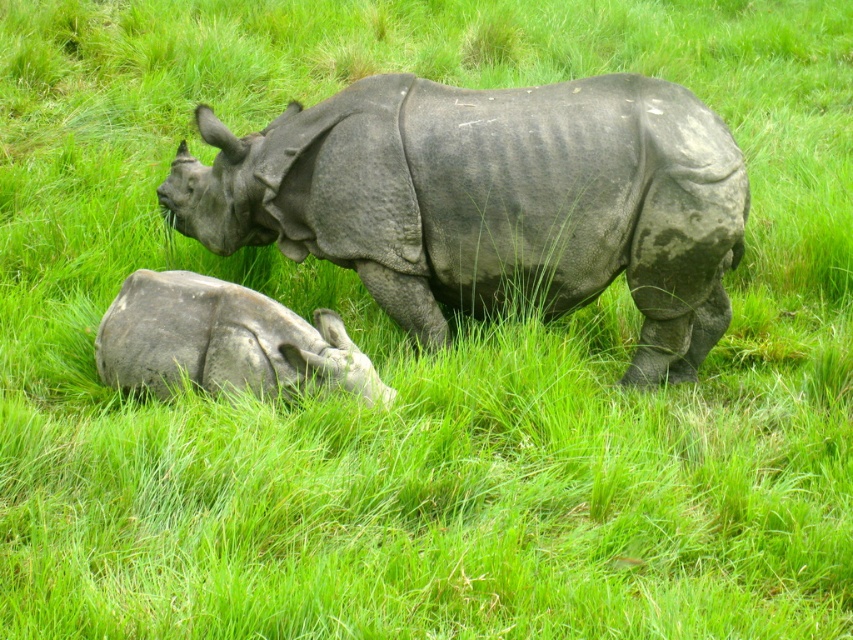
Question: Which point is farther to the camera?

Choices:
 (A) (486, 307)
 (B) (323, 323)

Answer: (A)

Question: Can you confirm if gray textured rhino at center is smaller than gray matte rhino at lower left?

Choices:
 (A) yes
 (B) no

Answer: (B)

Question: Which point is closer to the camera taking this photo?

Choices:
 (A) (306, 364)
 (B) (587, 250)

Answer: (A)

Question: Among these points, which one is farthest from the camera?

Choices:
 (A) (216, 344)
 (B) (421, 172)

Answer: (B)

Question: Does gray textured rhino at center appear under gray matte rhino at lower left?

Choices:
 (A) no
 (B) yes

Answer: (A)

Question: Is gray textured rhino at center positioned in front of gray matte rhino at lower left?

Choices:
 (A) yes
 (B) no

Answer: (B)